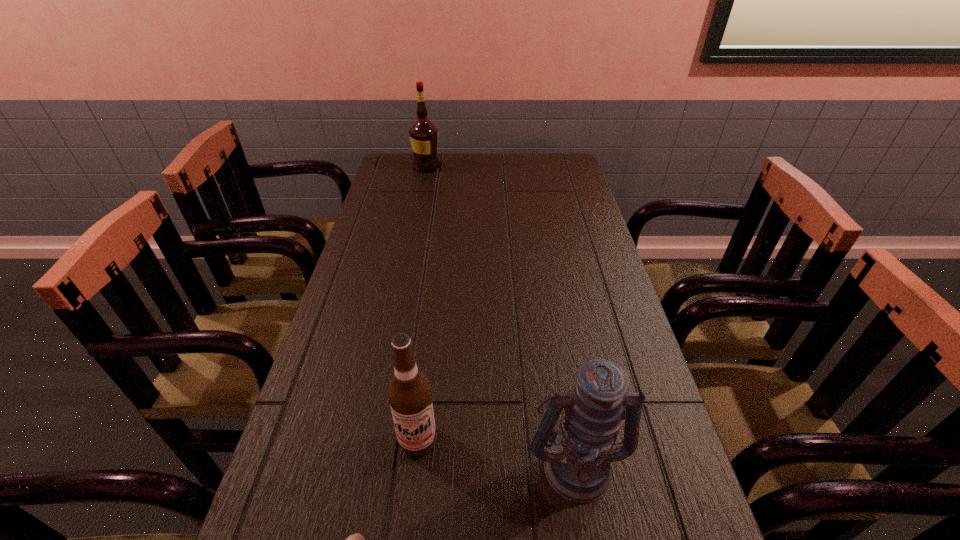
You are a GUI agent. You are given a task and a screenshot of the screen. Output one action in this format:
    pyautogui.click(x=<x>, y=<y>)
    Task: Click on the free space between the farthest object and the nearer alcohol
    The image size is (960, 540).
    Given the screenshot: What is the action you would take?
    pyautogui.click(x=422, y=303)

This screenshot has height=540, width=960. I want to click on empty space between the farthest object and the lantern, so click(501, 316).

The image size is (960, 540). Identify the location of free space between the farthest object and the rightmost object. (501, 316).

At what (x,y) coordinates should I click in order to perform the action: click on the third closest object to the farthest object. Please return your answer as a coordinate pair (x, y). Image resolution: width=960 pixels, height=540 pixels. Looking at the image, I should click on (356, 539).

Identify which object is the second closest to the lantern. Please provide its 2D coordinates. Your answer should be formatted as a tuple, i.e. [(x, y)], where the tuple contains the x and y coordinates of a point satisfying the conditions above.

[(356, 539)]